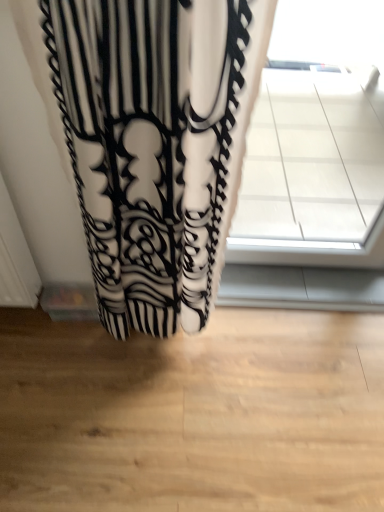
Question: Should I look upward or downward to see white tile at upper right?

Choices:
 (A) down
 (B) up

Answer: (B)